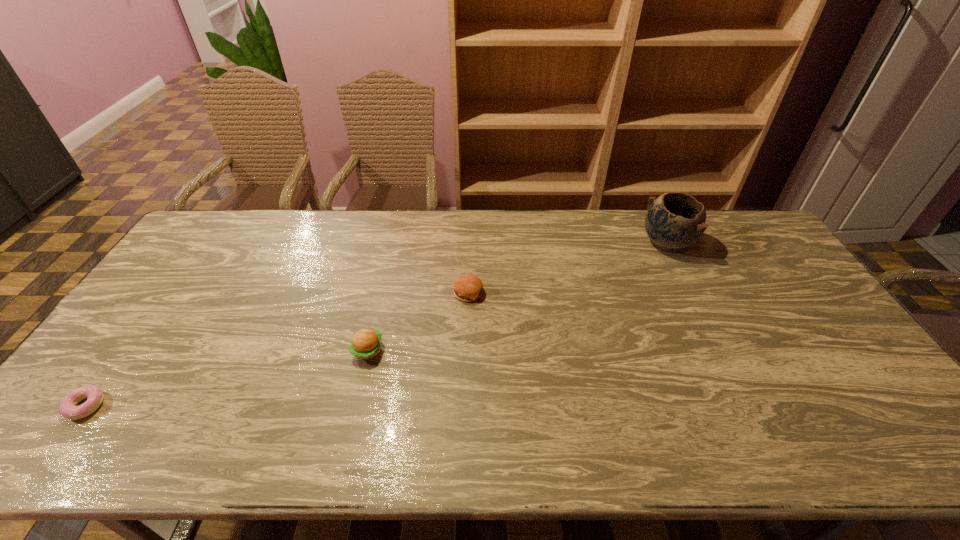
Find the location of a particular element. the farthest object is located at coordinates point(675,220).

This screenshot has width=960, height=540. In order to click on pottery in this screenshot , I will do `click(675, 220)`.

The width and height of the screenshot is (960, 540). I want to click on the taller hamburger, so click(x=365, y=344).

Where is `the third object from right to left`? The width and height of the screenshot is (960, 540). the third object from right to left is located at coordinates (365, 344).

Locate an element on the screen. This screenshot has height=540, width=960. the third object from left to right is located at coordinates (467, 287).

At what (x,y) coordinates should I click in order to perform the action: click on the shorter hamburger. Please return your answer as a coordinate pair (x, y). The image size is (960, 540). Looking at the image, I should click on (467, 287).

Where is `the nearest object`? the nearest object is located at coordinates (94, 395).

The width and height of the screenshot is (960, 540). In order to click on doughnut in this screenshot , I will do `click(94, 395)`.

Where is `blank space located 0.060m on the left of the rightmost object`? This screenshot has width=960, height=540. blank space located 0.060m on the left of the rightmost object is located at coordinates (623, 243).

The image size is (960, 540). Find the location of `vacant space located 0.060m on the front of the taller hamburger`. vacant space located 0.060m on the front of the taller hamburger is located at coordinates (360, 386).